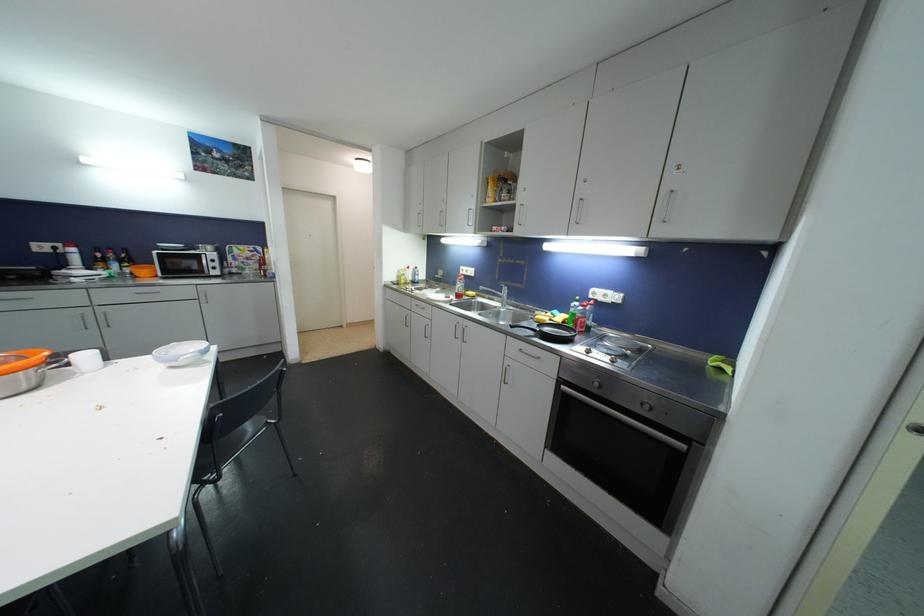
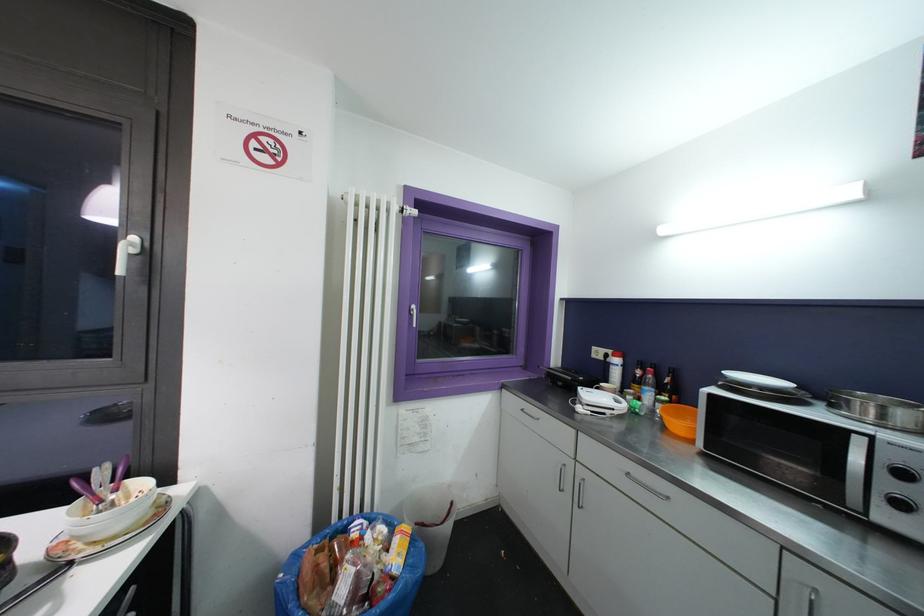
Find the pixel in the second image that matches (x=217, y=270) in the first image.

(904, 508)